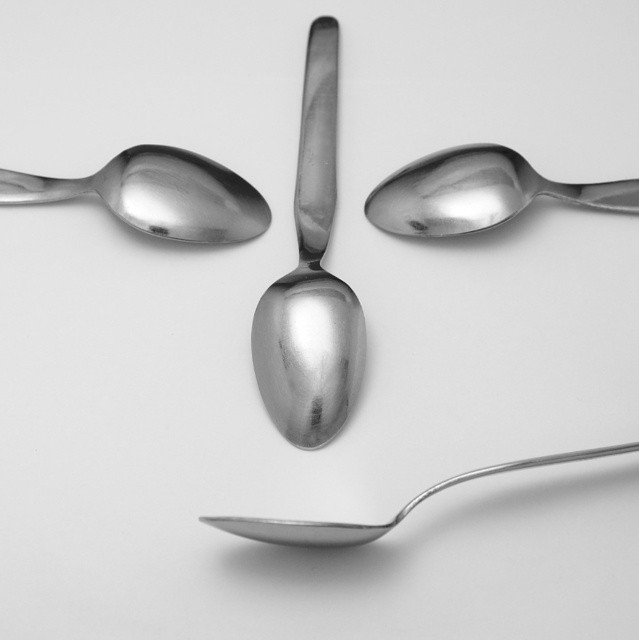
You are looking at the four metallic spoons arranged on a white background. There is a point labeled at coordinates point (477, 193). Which object does this point belong to?

The point (477, 193) is on the polished metal spoon at upper center.

You are arranging cutlery on a table and need to place the polished metal spoon at center and the polished metal spoon at upper center side by side. Which spoon should you place on the left to ensure they are arranged from narrowest to widest?

The polished metal spoon at center has a lesser width compared to the polished metal spoon at upper center. Therefore, you should place the polished metal spoon at center on the left followed by the polished metal spoon at upper center to arrange them from narrowest to widest.